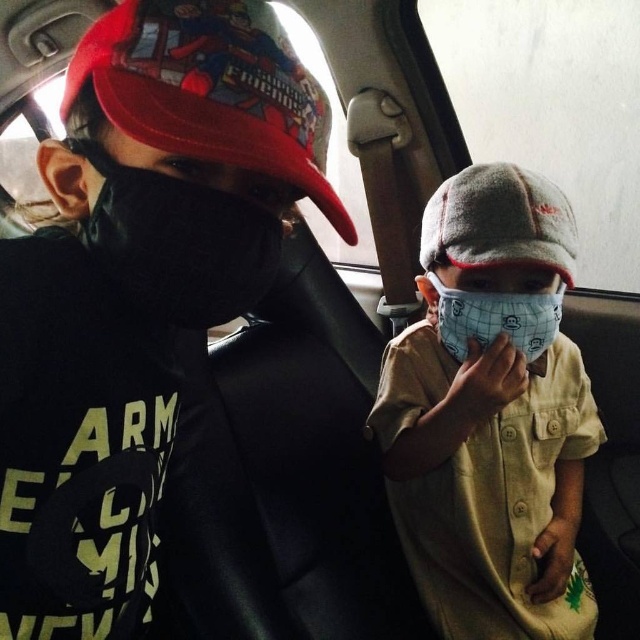
Is point (400, 476) more distant than point (218, 193)?

Yes, it is behind point (218, 193).

Can you confirm if white fabric mask at center is positioned to the right of black matte mask at left?

Correct, you'll find white fabric mask at center to the right of black matte mask at left.

The width and height of the screenshot is (640, 640). Describe the element at coordinates (490, 417) in the screenshot. I see `white fabric mask at center` at that location.

Where is `white fabric mask at center`? white fabric mask at center is located at coordinates (x=490, y=417).

Can you confirm if black matte mask at left is positioned to the right of white mesh mask at center?

In fact, black matte mask at left is to the left of white mesh mask at center.

Is black matte mask at left thinner than white mesh mask at center?

Incorrect, black matte mask at left's width is not less than white mesh mask at center's.

The image size is (640, 640). Find the location of `black matte mask at left`. black matte mask at left is located at coordinates (179, 243).

Where is `black matte mask at left`? The image size is (640, 640). black matte mask at left is located at coordinates (179, 243).

Which is behind, point (572, 348) or point (452, 355)?

The point (572, 348) is more distant.

Which is more to the left, white fabric mask at center or white mesh mask at center?

white mesh mask at center is more to the left.

Who is more forward, [528,548] or [484,298]?

Point [484,298] is in front.

Find the location of `white fabric mask at center`. white fabric mask at center is located at coordinates (490, 417).